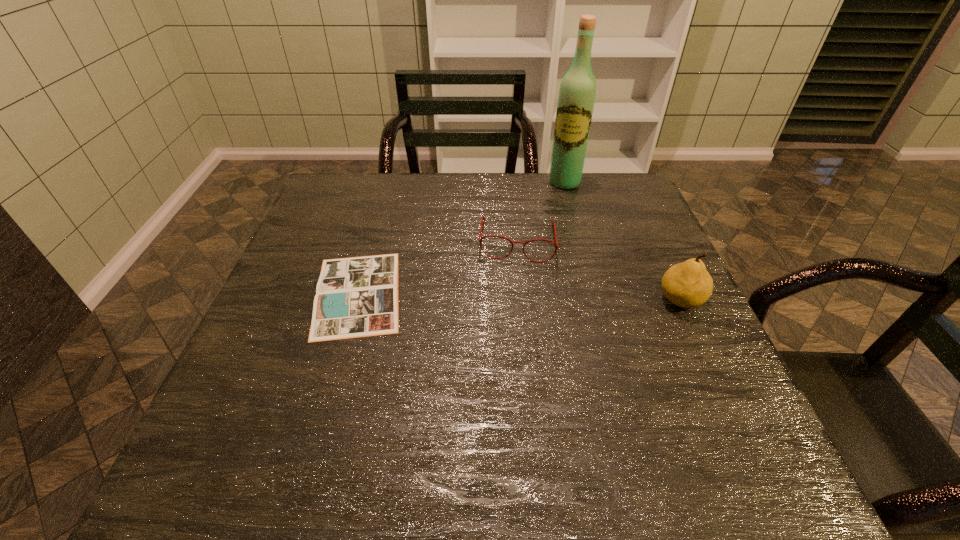
Locate an element on the screen. The height and width of the screenshot is (540, 960). vacant region located 0.220m on the front-facing side of the third object from left to right is located at coordinates (550, 233).

This screenshot has height=540, width=960. Identify the location of free space located on the front-facing side of the third object from left to right. (542, 261).

Identify the location of free space located 0.390m on the front-facing side of the third object from left to right. The image size is (960, 540). (539, 274).

The image size is (960, 540). I want to click on blank space located 0.300m on the face of the third object from right to left, so click(x=507, y=363).

Where is `free spot located 0.380m on the face of the third object from right to left`? free spot located 0.380m on the face of the third object from right to left is located at coordinates point(504,399).

Where is `free spot located 0.390m on the face of the third object from right to left`? The height and width of the screenshot is (540, 960). free spot located 0.390m on the face of the third object from right to left is located at coordinates 503,403.

I want to click on object that is at the far edge, so click(577, 92).

The image size is (960, 540). What are the coordinates of `object that is at the left edge` in the screenshot? It's located at (355, 297).

Identify the location of object located in the right edge section of the desktop. This screenshot has height=540, width=960. (688, 284).

This screenshot has height=540, width=960. In order to click on vacant space at the far edge of the desktop in this screenshot , I will do `click(463, 200)`.